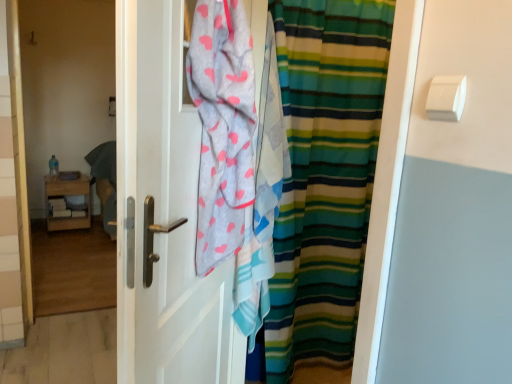
Question: Is point [54, 157] positioned closer to the camera than point [445, 97]?

Choices:
 (A) farther
 (B) closer

Answer: (A)

Question: Is teal fabric at left bigger or smaller than white plastic towel bar at upper right?

Choices:
 (A) small
 (B) big

Answer: (B)

Question: Considering the real-world distances, which object is closest to the striped fabric curtain at center?

Choices:
 (A) white matte door at center
 (B) teal fabric at left
 (C) light gray cotton towel at center
 (D) white plastic towel bar at upper right
 (E) woodenmaterial/texturenightstand at left

Answer: (A)

Question: Estimate the real-world distances between objects in this image. Which object is closer to the white matte door at center?

Choices:
 (A) white plastic towel bar at upper right
 (B) light gray cotton towel at center
 (C) striped fabric curtain at center
 (D) teal fabric at left
 (E) woodenmaterial/texturenightstand at left

Answer: (B)